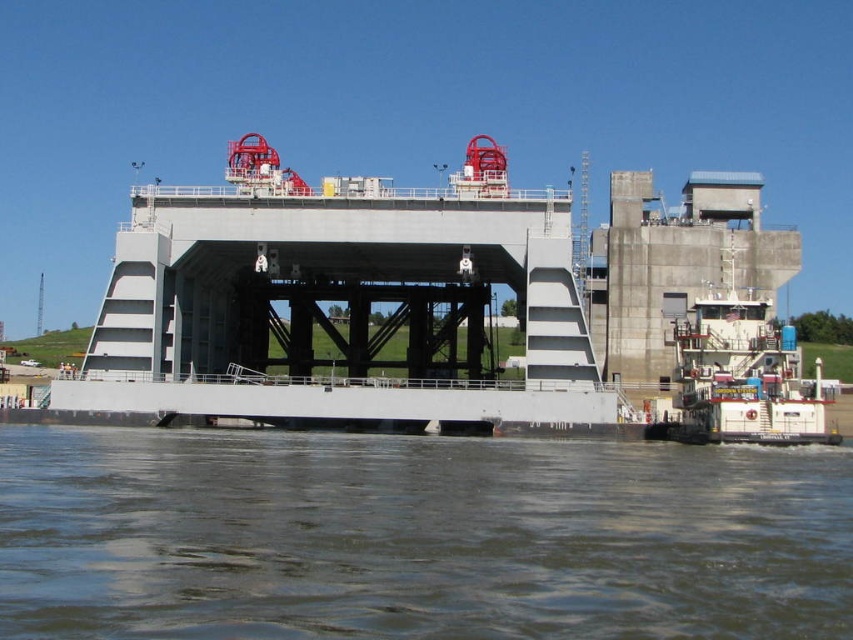
You are a crane operator standing on the gray metallic bridge at center. You need to lower a heavy container into the brown murky water at lower center. Can you safely lower the container into the water without hitting the bridge?

The brown murky water at lower center and gray metallic bridge at center are 33.79 meters apart. Since the distance between them is sufficient, you can safely lower the container into the water without hitting the bridge.

You are a tugboat captain trying to navigate your white matte tugboat at lower right through the narrow channel near the industrial structure. Based on the scene, can you determine if the brown murky water at lower center is wide enough to allow your tugboat to pass safely?

The brown murky water at lower center might be wider than the white matte tugboat at lower right, so there is a possibility that the tugboat can pass safely through the channel. However, the exact width is uncertain and caution is advised.